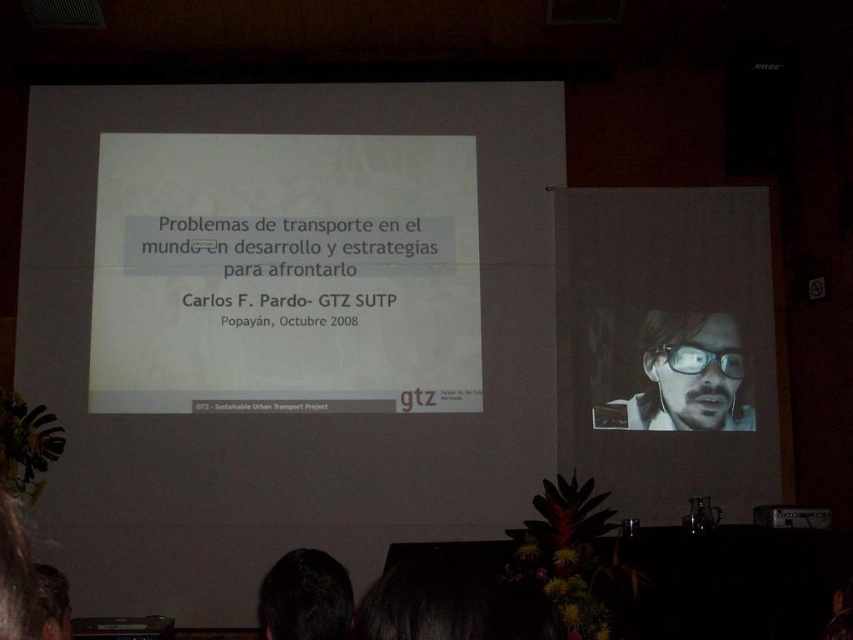
You are an attendee at this presentation and want to see both the speaker and the main slide. The speaker is visible through the dark brown hair at lower center. Can you adjust your seat to view both the matte white screen at right and the speaker simultaneously?

Yes, since the matte white screen at right is located above the dark brown hair at lower center where the speaker is visible, you can position yourself to see both by looking upwards towards the screen and downwards slightly to see the speaker through the dark brown hair at lower center.

Based on the photo, you are sitting in the audience and want to look at both the matte black glasses at upper right and the dark brown hair at lower center. Which one would you need to look up more to see?

The matte black glasses at upper right is much taller than the dark brown hair at lower center, so you would need to look up more to see the matte black glasses at upper right.